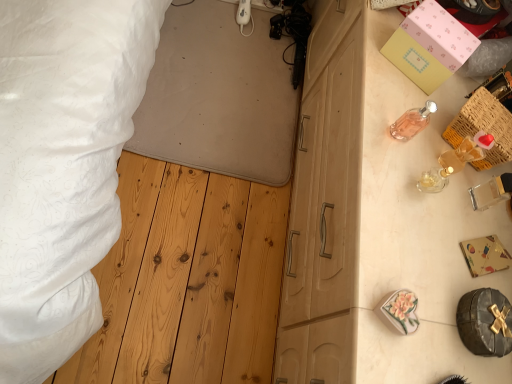
Where is `free location in front of woven wood crate at upper right`? This screenshot has height=384, width=512. free location in front of woven wood crate at upper right is located at coordinates (436, 187).